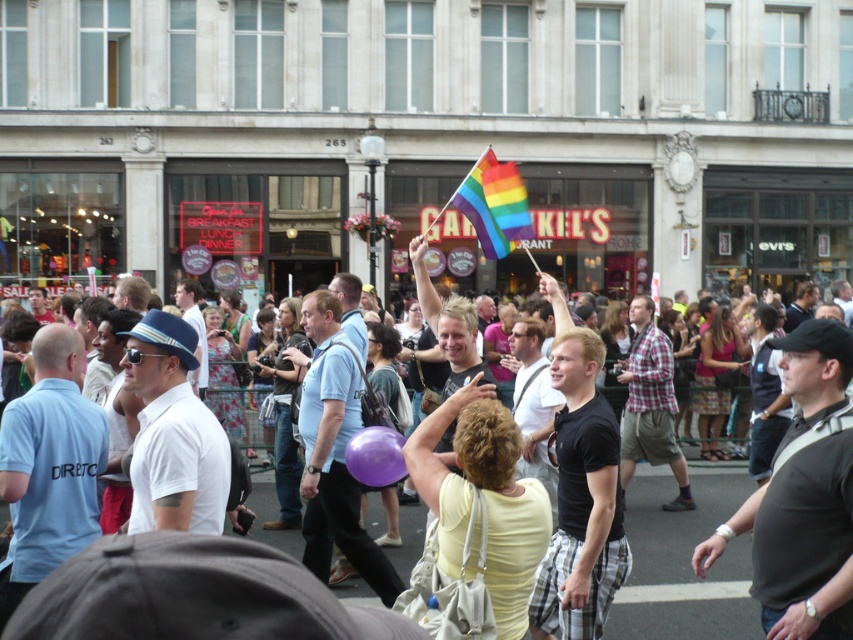
You are organizing a parade and need to decide which flag to use for the front of the procession. The rainbow flag at center and the rainbow fabric flag at upper center are both available. Which flag has a greater width and would be more visible to the crowd?

The rainbow flag at center has a greater width than the rainbow fabric flag at upper center, making it more visible to the crowd.

You are a photographer standing at the edge of the crowd. You want to capture both the rainbow flag at center and the rainbow fabric flag at upper center in a single photo. Given that your camera has a maximum focus range of 15 feet, will you be able to focus on both flags simultaneously?

The rainbow flag at center is 15.29 feet from the rainbow fabric flag at upper center. Since the distance between them exceeds the camera maximum focus range of 15 feet, you cannot focus on both flags simultaneously.

You are attending a pride parade and see the rainbow flag at center and the rainbow fabric flag at upper center. Which flag is positioned higher up in the image?

The rainbow fabric flag at upper center is positioned higher up in the image than the rainbow flag at center.